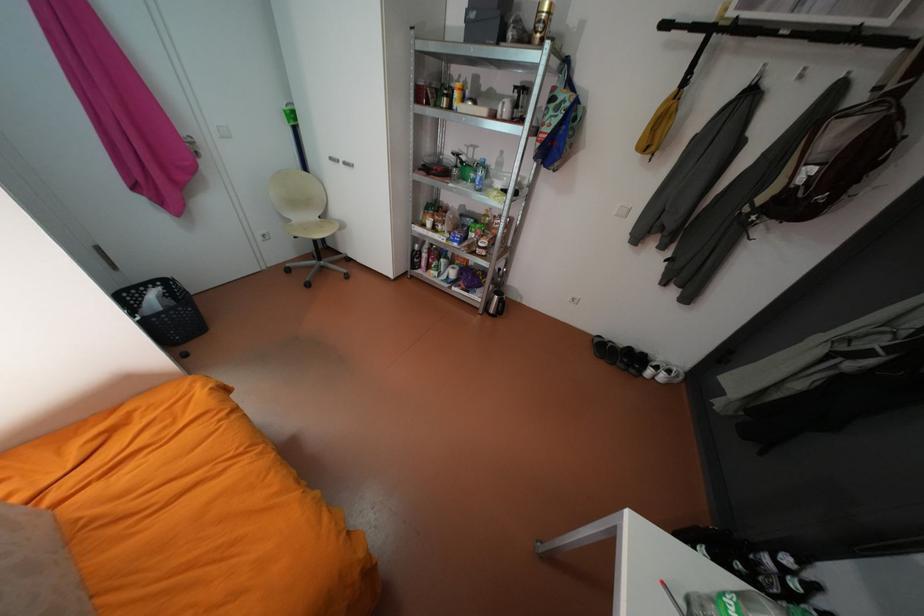
Where is `black mesh basket`? This screenshot has height=616, width=924. black mesh basket is located at coordinates (164, 310).